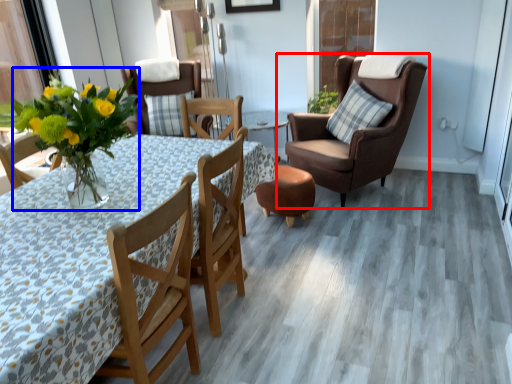
Question: Which point is further to the camera, chair (highlighted by a red box) or floral arrangement (highlighted by a blue box)?

Choices:
 (A) chair
 (B) floral arrangement

Answer: (A)